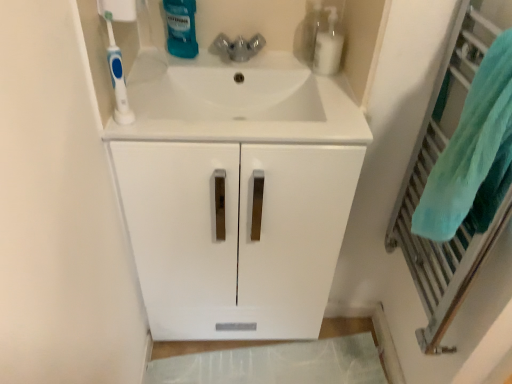
Question: From the image's perspective, is white matte cabinet at center on top of translucent plastic mouthwash at upper center, which is the second cleaning product in right-to-left order?

Choices:
 (A) yes
 (B) no

Answer: (B)

Question: Is white matte cabinet at center closer to camera compared to translucent plastic mouthwash at upper center, the first cleaning product positioned from the left?

Choices:
 (A) no
 (B) yes

Answer: (B)

Question: Is white matte cabinet at center oriented away from translucent plastic mouthwash at upper center, which is the second cleaning product in right-to-left order?

Choices:
 (A) yes
 (B) no

Answer: (B)

Question: From a real-world perspective, is white matte cabinet at center under translucent plastic mouthwash at upper center, which is the second cleaning product in right-to-left order?

Choices:
 (A) no
 (B) yes

Answer: (B)

Question: Is white matte cabinet at center taller than translucent plastic mouthwash at upper center, which is the second cleaning product in right-to-left order?

Choices:
 (A) yes
 (B) no

Answer: (A)

Question: Relative to teal fabric towel at right, is white glossy sink at center in front or behind?

Choices:
 (A) behind
 (B) front

Answer: (A)

Question: Is white glossy sink at center wider or thinner than teal fabric towel at right?

Choices:
 (A) thin
 (B) wide

Answer: (B)

Question: Based on their positions, is white glossy sink at center located to the left or right of teal fabric towel at right?

Choices:
 (A) right
 (B) left

Answer: (B)

Question: Considering the positions of white glossy sink at center and teal fabric towel at right in the image, is white glossy sink at center bigger or smaller than teal fabric towel at right?

Choices:
 (A) small
 (B) big

Answer: (B)

Question: Is clear plastic bottle at upper right, marked as the second cleaning product in a left-to-right arrangement, bigger or smaller than translucent plastic mouthwash at upper center, which is the second cleaning product in right-to-left order?

Choices:
 (A) small
 (B) big

Answer: (A)

Question: Based on their positions, is clear plastic bottle at upper right, marked as the second cleaning product in a left-to-right arrangement, located to the left or right of translucent plastic mouthwash at upper center, the first cleaning product positioned from the left?

Choices:
 (A) left
 (B) right

Answer: (B)

Question: In terms of width, does clear plastic bottle at upper right, the 1th cleaning product positioned from the right, look wider or thinner when compared to translucent plastic mouthwash at upper center, which is the second cleaning product in right-to-left order?

Choices:
 (A) thin
 (B) wide

Answer: (B)

Question: Which is correct: clear plastic bottle at upper right, marked as the second cleaning product in a left-to-right arrangement, is inside translucent plastic mouthwash at upper center, which is the second cleaning product in right-to-left order, or outside of it?

Choices:
 (A) inside
 (B) outside

Answer: (B)

Question: Considering the positions of point (490, 114) and point (206, 84), is point (490, 114) closer or farther from the camera than point (206, 84)?

Choices:
 (A) farther
 (B) closer

Answer: (B)

Question: Which is correct: teal soft towel at right is inside white glossy sink at center, or outside of it?

Choices:
 (A) outside
 (B) inside

Answer: (A)